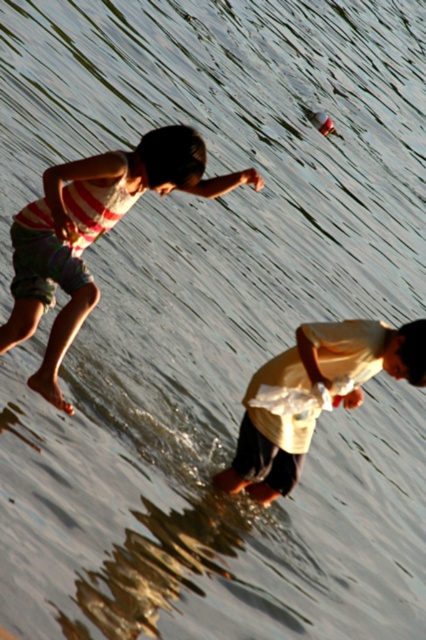
Question: Can you confirm if striped cotton shorts at left is positioned below yellow cotton shirt at lower right?

Choices:
 (A) no
 (B) yes

Answer: (A)

Question: Where is striped cotton shorts at left located in relation to yellow cotton shirt at lower right in the image?

Choices:
 (A) left
 (B) right

Answer: (A)

Question: Which point is farther to the camera?

Choices:
 (A) (412, 342)
 (B) (62, 401)

Answer: (A)

Question: Which point is farther from the camera taking this photo?

Choices:
 (A) (88, 291)
 (B) (414, 336)

Answer: (B)

Question: Does striped cotton shorts at left lie behind yellow cotton shirt at lower right?

Choices:
 (A) yes
 (B) no

Answer: (B)

Question: Which point is closer to the camera taking this photo?

Choices:
 (A) (331, 346)
 (B) (60, 342)

Answer: (B)